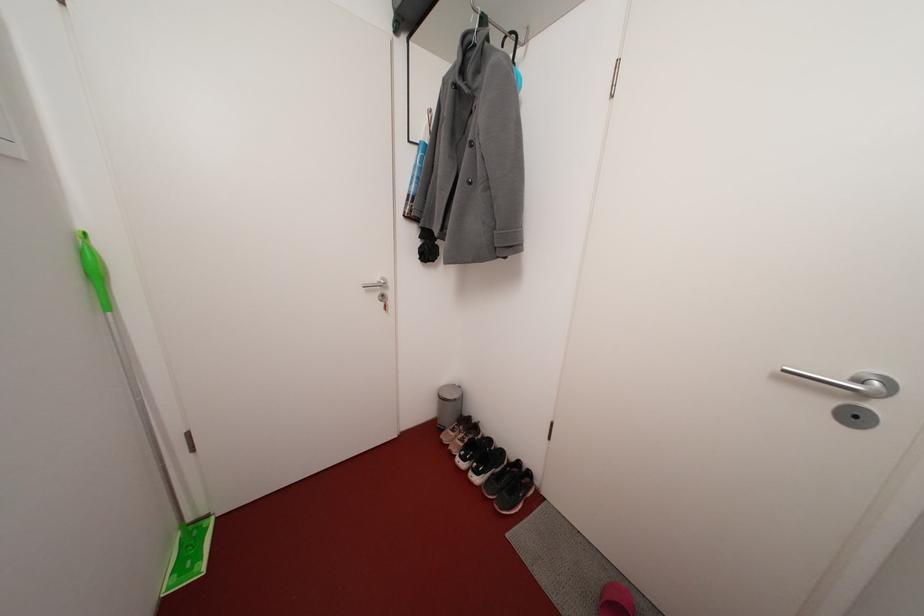
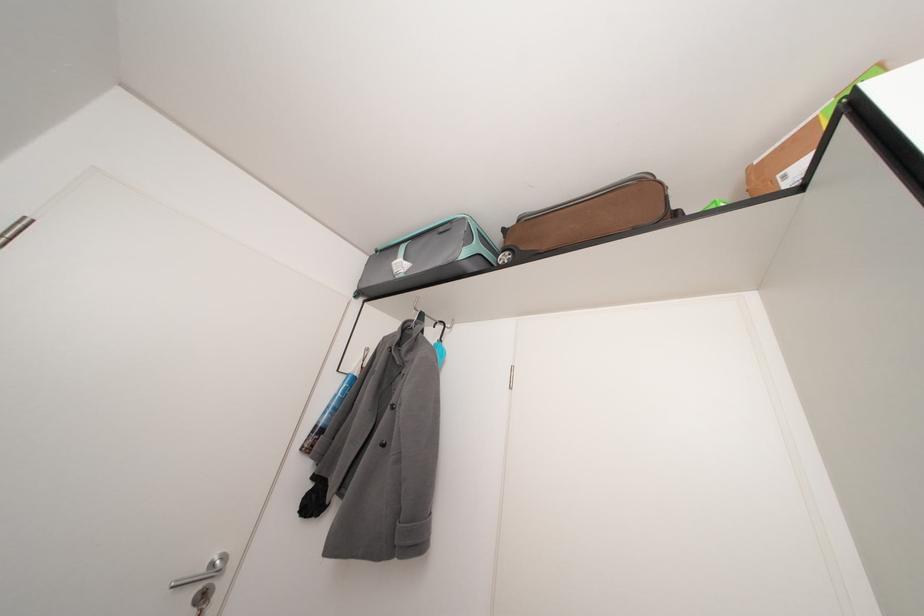
In the second image, find the point that corresponds to (517,37) in the first image.

(447, 328)